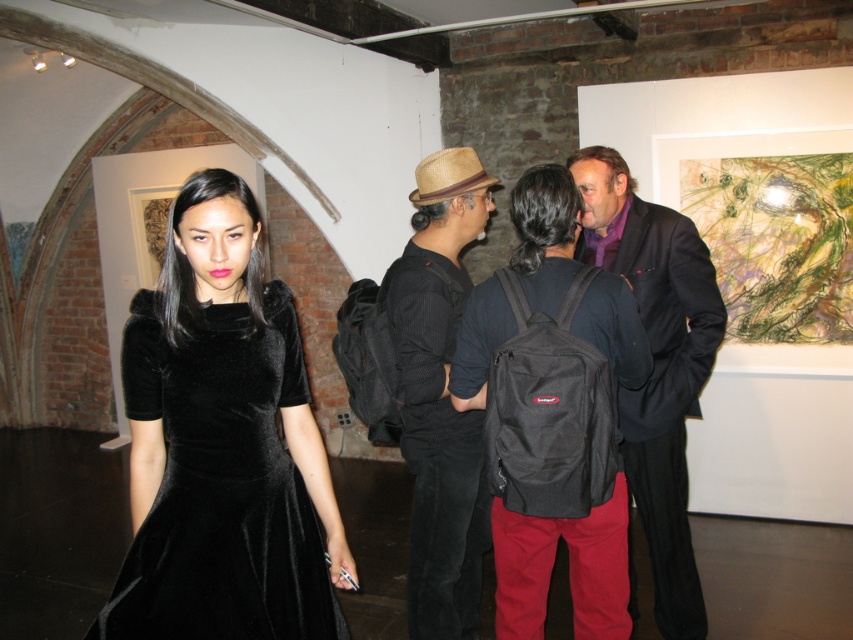
You are an artist trying to sketch the scene. You notice the black velvet dress at center and the straw hat at center. Which object should you draw first if you want to capture the larger one first?

The black velvet dress at center should be drawn first because its width is larger than the straw hat at center.

You are an art gallery assistant who needs to place a new painting between the straw hat at center and the dark suit at center. Which object should the painting be placed above to ensure it hangs properly?

The painting should be placed above the dark suit at center because the straw hat at center is below the dark suit at center, so the dark suit is higher up.

You are an event planner organizing a photoshoot in this gallery. You need to position a 1.2 meter wide backdrop between the black velvet dress at center and the dark suit at center. Is there enough space to place it without moving either of the people?

The distance between the black velvet dress at center and the dark suit at center is 50.47 centimeters. Since the backdrop is 1.2 meters wide, which is 120 centimeters, there is not enough space to place it between them without moving either of the people.